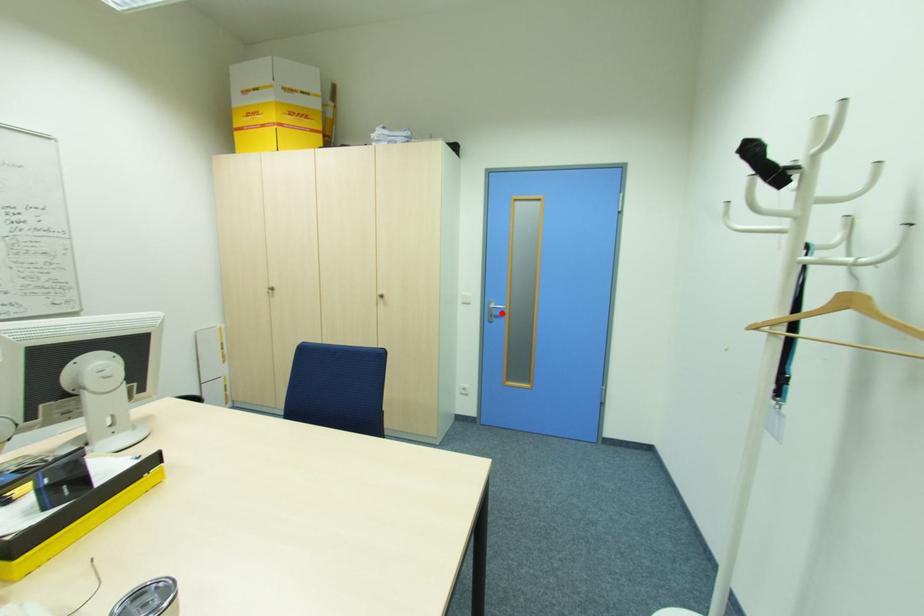
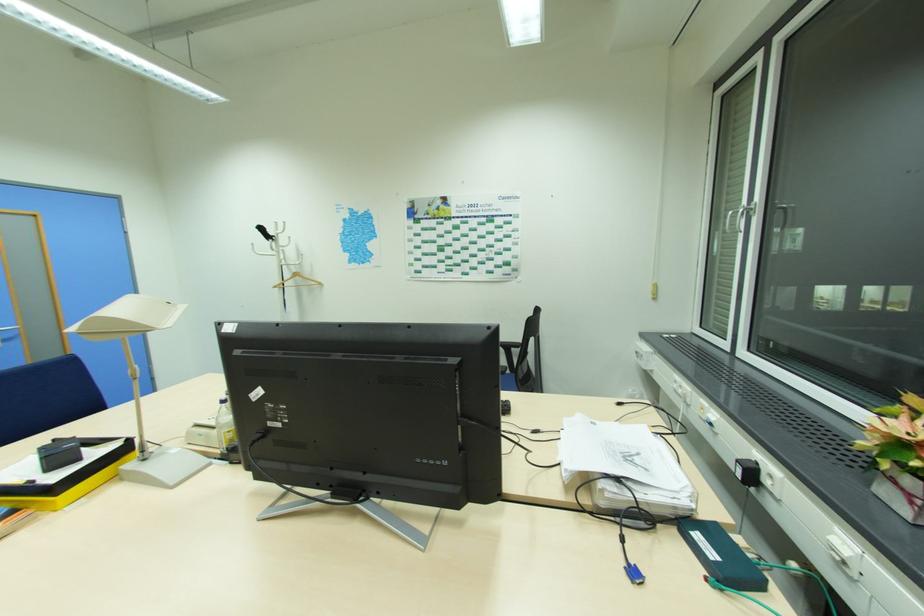
Find the pixel in the second image that matches the highlighted location in the first image.

(11, 337)